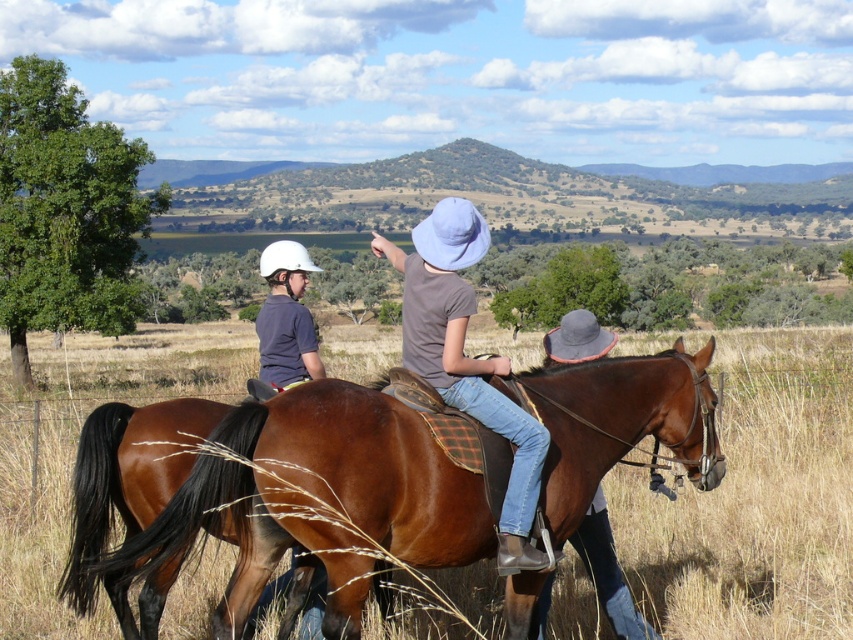
Question: Can you confirm if shiny brown horse at center is positioned to the right of matte white helmet at left?

Choices:
 (A) no
 (B) yes

Answer: (B)

Question: Can you confirm if shiny brown horse at center is wider than matte white helmet at left?

Choices:
 (A) yes
 (B) no

Answer: (A)

Question: Which object is the closest to the shiny brown horse at center?

Choices:
 (A) matte white helmet at left
 (B) denim jeans at center

Answer: (B)

Question: Can you confirm if shiny brown horse at center is smaller than denim jeans at center?

Choices:
 (A) yes
 (B) no

Answer: (B)

Question: Which point appears closest to the camera in this image?

Choices:
 (A) (428, 253)
 (B) (300, 272)

Answer: (A)

Question: Which object appears closest to the camera in this image?

Choices:
 (A) denim jeans at center
 (B) shiny brown horse at center

Answer: (B)